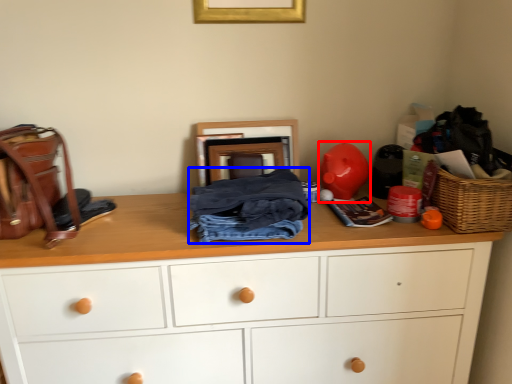
Question: Which object appears farthest to the camera in this image, toy (highlighted by a red box) or clothing (highlighted by a blue box)?

Choices:
 (A) toy
 (B) clothing

Answer: (A)